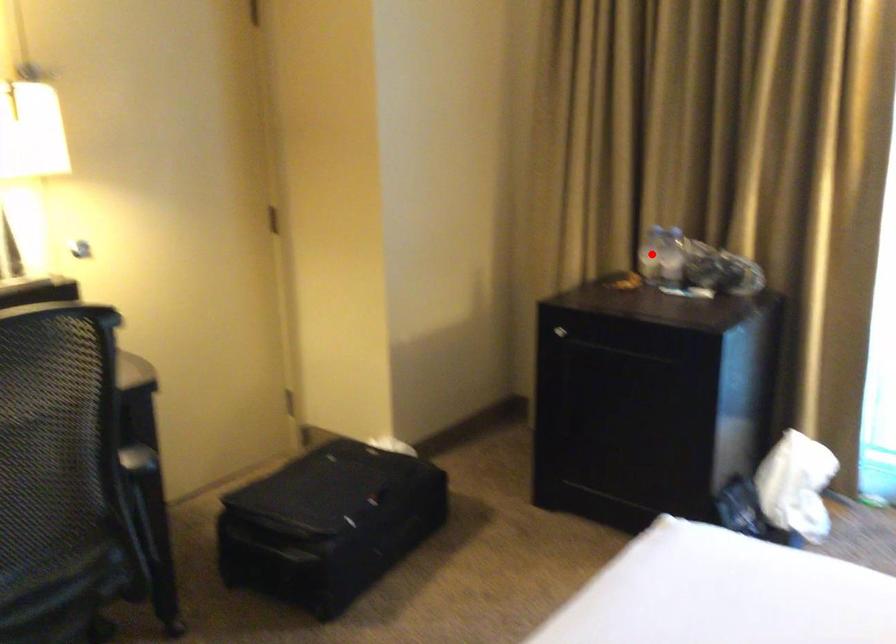
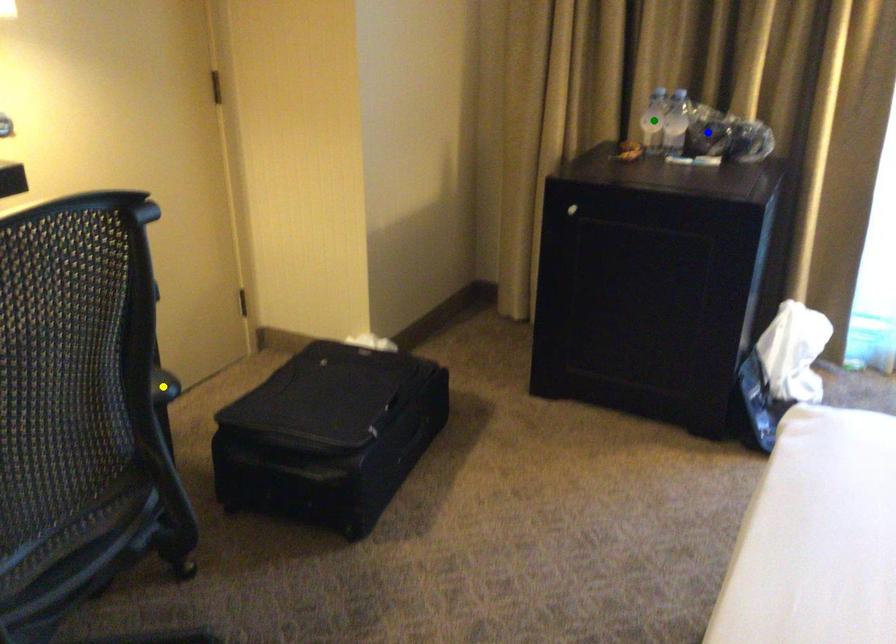
Question: I am providing you with two images of the same scene from different viewpoints. A red point is marked on the first image. You are given multiple points on the second image. Which point in image 2 is actually the same real-world point as the red point in image 1?

Choices:
 (A) green point
 (B) yellow point
 (C) blue point

Answer: (A)